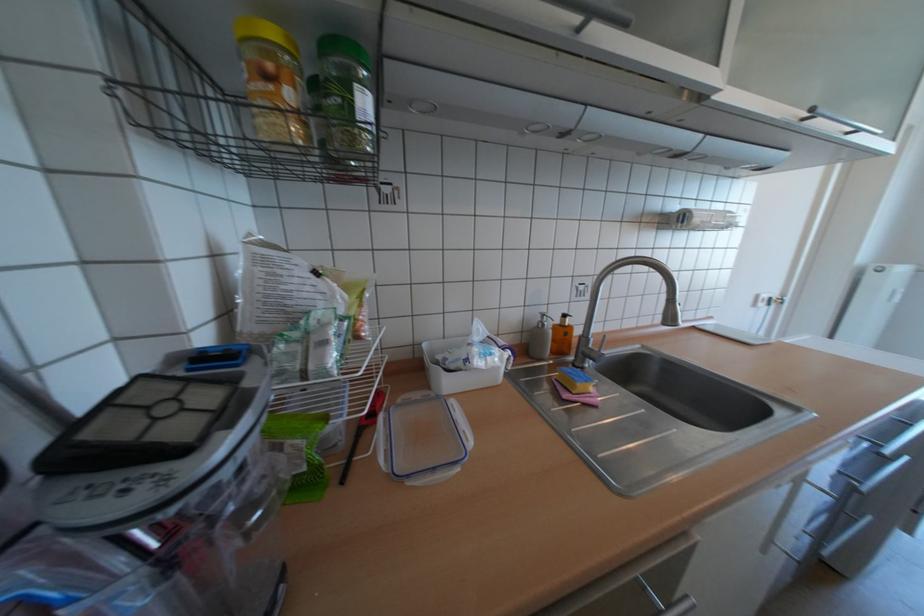
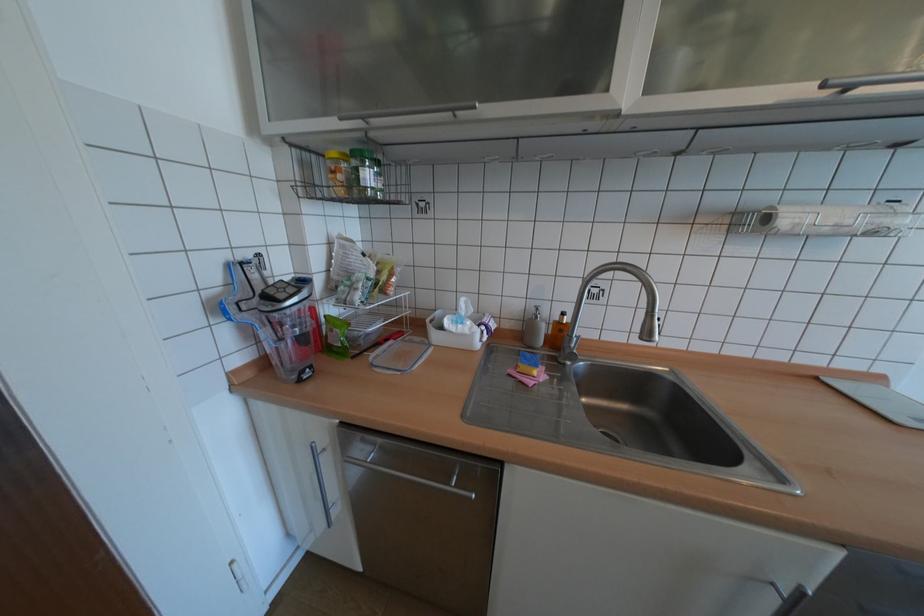
Locate, in the second image, the point that corresponds to point 497,359 in the first image.

(468, 326)